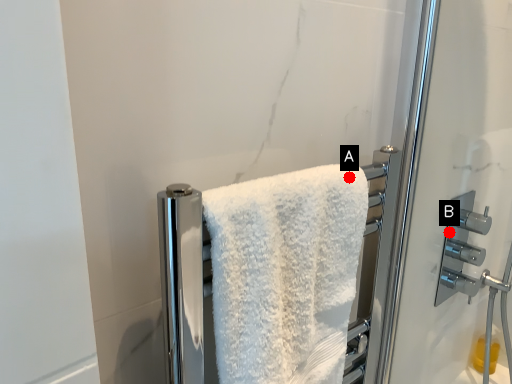
Question: Two points are circled on the image, labeled by A and B beside each circle. Which point appears closest to the camera in this image?

Choices:
 (A) A is closer
 (B) B is closer

Answer: (A)